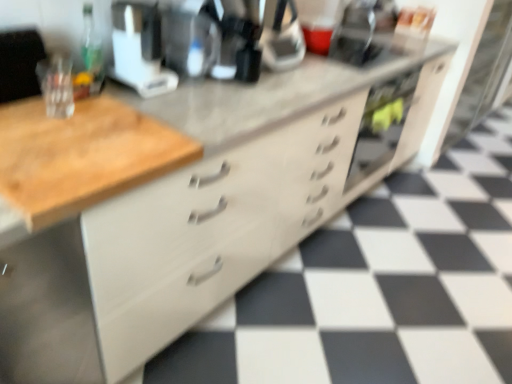
Locate an element on the screen. The height and width of the screenshot is (384, 512). vacant area that is in front of white plastic coffee maker at upper center is located at coordinates (136, 103).